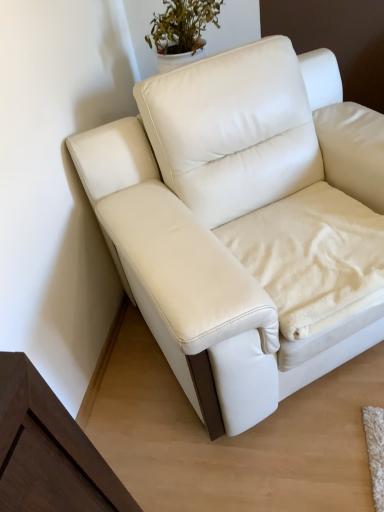
Question: Does point (238, 226) appear closer or farther from the camera than point (281, 206)?

Choices:
 (A) closer
 (B) farther

Answer: (A)

Question: From a real-world perspective, is white fleece blanket at lower right positioned above or below white leather couch at center?

Choices:
 (A) below
 (B) above

Answer: (A)

Question: In terms of width, does white fleece blanket at lower right look wider or thinner when compared to white leather couch at center?

Choices:
 (A) wide
 (B) thin

Answer: (B)

Question: In the image, is white leather couch at center positioned in front of or behind white fleece blanket at lower right?

Choices:
 (A) front
 (B) behind

Answer: (A)

Question: In terms of width, does white leather couch at center look wider or thinner when compared to white fleece blanket at lower right?

Choices:
 (A) wide
 (B) thin

Answer: (A)

Question: From a real-world perspective, is white leather couch at center physically located above or below white fleece blanket at lower right?

Choices:
 (A) above
 (B) below

Answer: (A)

Question: From the image's perspective, is white leather couch at center positioned above or below white fleece blanket at lower right?

Choices:
 (A) above
 (B) below

Answer: (A)